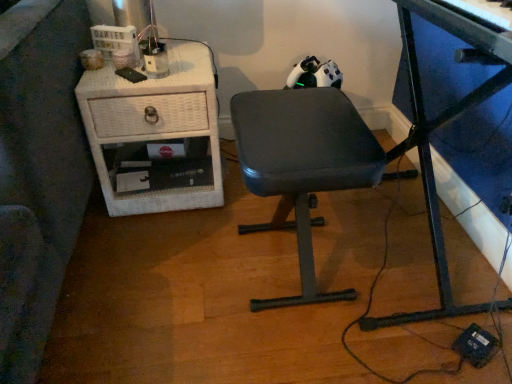
Question: Is metallic blue desk at center completely or partially outside of white wicker nightstand at left?

Choices:
 (A) yes
 (B) no

Answer: (A)

Question: Is metallic blue desk at center positioned with its back to white wicker nightstand at left?

Choices:
 (A) no
 (B) yes

Answer: (A)

Question: Does metallic blue desk at center turn towards white wicker nightstand at left?

Choices:
 (A) no
 (B) yes

Answer: (B)

Question: Does metallic blue desk at center lie in front of white wicker nightstand at left?

Choices:
 (A) no
 (B) yes

Answer: (B)

Question: Considering the relative sizes of metallic blue desk at center and white wicker nightstand at left in the image provided, is metallic blue desk at center thinner than white wicker nightstand at left?

Choices:
 (A) no
 (B) yes

Answer: (B)

Question: In terms of height, does metallic blue desk at center look taller or shorter compared to white wicker nightstand at left?

Choices:
 (A) short
 (B) tall

Answer: (B)

Question: Is point (443, 244) positioned closer to the camera than point (221, 190)?

Choices:
 (A) closer
 (B) farther

Answer: (A)

Question: Is metallic blue desk at center spatially inside white wicker nightstand at left, or outside of it?

Choices:
 (A) outside
 (B) inside

Answer: (A)

Question: Considering the positions of metallic blue desk at center and white wicker nightstand at left in the image, is metallic blue desk at center bigger or smaller than white wicker nightstand at left?

Choices:
 (A) small
 (B) big

Answer: (B)

Question: From the image's perspective, relative to white wicker nightstand at left, is dark gray fabric chair at center above or below?

Choices:
 (A) above
 (B) below

Answer: (B)

Question: Is dark gray fabric chair at center taller or shorter than white wicker nightstand at left?

Choices:
 (A) tall
 (B) short

Answer: (A)

Question: In the image, is dark gray fabric chair at center on the left side or the right side of white wicker nightstand at left?

Choices:
 (A) right
 (B) left

Answer: (A)

Question: Looking at their shapes, would you say dark gray fabric chair at center is wider or thinner than white wicker nightstand at left?

Choices:
 (A) wide
 (B) thin

Answer: (B)

Question: From their relative heights in the image, would you say metallic blue desk at center is taller or shorter than dark gray fabric chair at center?

Choices:
 (A) short
 (B) tall

Answer: (B)

Question: Considering the positions of metallic blue desk at center and dark gray fabric chair at center in the image, is metallic blue desk at center bigger or smaller than dark gray fabric chair at center?

Choices:
 (A) small
 (B) big

Answer: (B)